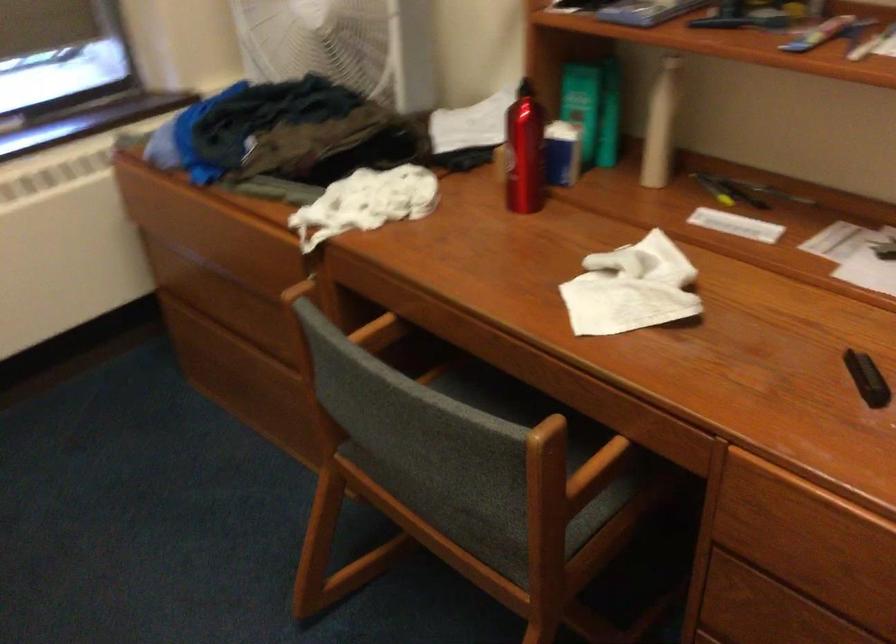
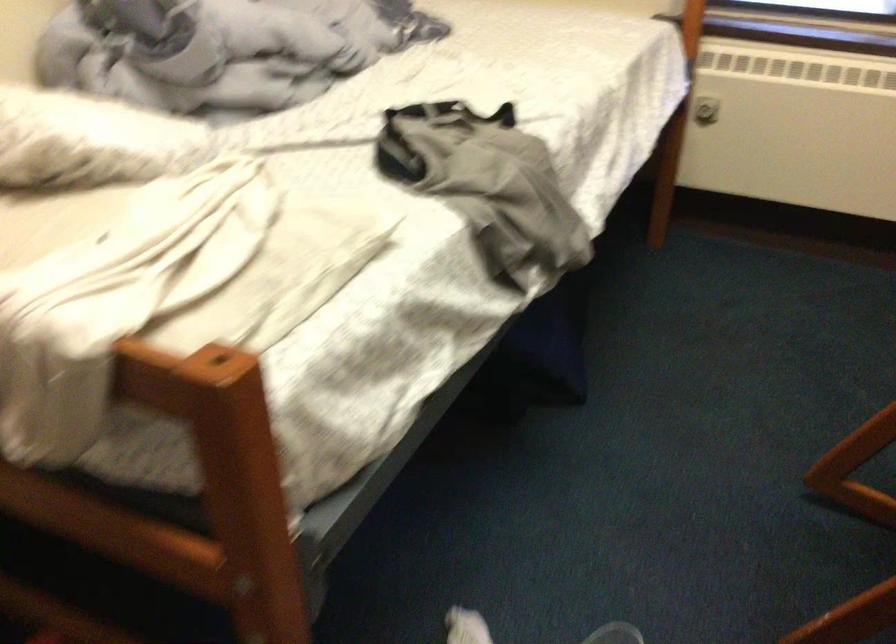
Based on the continuous images, in which direction is the camera rotating?

The camera rotated toward left-down.